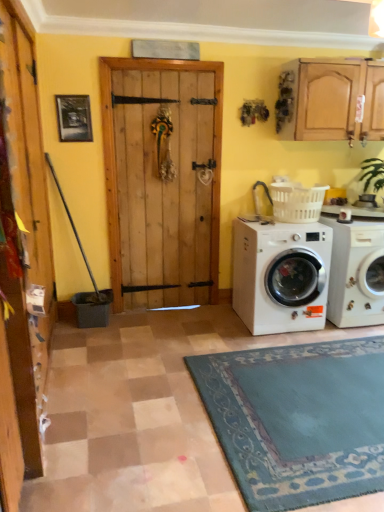
What is the approximate width of wooden door at left?

3.96 inches.

Where is `white plastic laundry basket at right`? The height and width of the screenshot is (512, 384). white plastic laundry basket at right is located at coordinates (296, 202).

Image resolution: width=384 pixels, height=512 pixels. What are the coordinates of `wooden door at left` in the screenshot? It's located at (25, 227).

Looking at their sizes, would you say wooden door at left is wider or thinner than white glossy washing machine at lower right, which is the 1th washing machine in right-to-left order?

Considering their sizes, wooden door at left looks slimmer than white glossy washing machine at lower right, which is the 1th washing machine in right-to-left order.

Does wooden door at left have a larger size compared to white glossy washing machine at lower right, the second washing machine when ordered from left to right?

Actually, wooden door at left might be smaller than white glossy washing machine at lower right, the second washing machine when ordered from left to right.

Between point (37, 308) and point (369, 293), which one is positioned in front?

The point (37, 308) is closer to the camera.

From the image's perspective, is wooden door at left above or below white glossy washing machine at lower right, the second washing machine when ordered from left to right?

From the image's perspective, wooden door at left appears above white glossy washing machine at lower right, the second washing machine when ordered from left to right.

Are white glossy washing machine at lower right, which is the 1th washing machine in right-to-left order, and white matte washing machine at lower right, marked as the 1th washing machine in a left-to-right arrangement, beside each other?

No, white glossy washing machine at lower right, which is the 1th washing machine in right-to-left order, is not next to white matte washing machine at lower right, marked as the 1th washing machine in a left-to-right arrangement.

Looking at this image, which is correct: white glossy washing machine at lower right, the second washing machine when ordered from left to right, is inside white matte washing machine at lower right, marked as the 1th washing machine in a left-to-right arrangement, or outside of it?

white glossy washing machine at lower right, the second washing machine when ordered from left to right, is outside white matte washing machine at lower right, marked as the 1th washing machine in a left-to-right arrangement.

Does white glossy washing machine at lower right, which is the 1th washing machine in right-to-left order, have a greater height compared to white matte washing machine at lower right, which is the second washing machine in right-to-left order?

Correct, white glossy washing machine at lower right, which is the 1th washing machine in right-to-left order, is much taller as white matte washing machine at lower right, which is the second washing machine in right-to-left order.

From the image's perspective, is white glossy washing machine at lower right, the second washing machine when ordered from left to right, located above or below white matte washing machine at lower right, which is the second washing machine in right-to-left order?

white glossy washing machine at lower right, the second washing machine when ordered from left to right, is situated higher than white matte washing machine at lower right, which is the second washing machine in right-to-left order, in the image.

From a real-world perspective, which is physically above, white plastic laundry basket at right or white glossy washing machine at lower right, which is the 1th washing machine in right-to-left order?

In real-world perspective, white plastic laundry basket at right is above.

Which object is thinner, white plastic laundry basket at right or white glossy washing machine at lower right, which is the 1th washing machine in right-to-left order?

With smaller width is white plastic laundry basket at right.

Between white plastic laundry basket at right and white glossy washing machine at lower right, the second washing machine when ordered from left to right, which one has more height?

white glossy washing machine at lower right, the second washing machine when ordered from left to right.

Can you confirm if white plastic laundry basket at right is bigger than white glossy washing machine at lower right, the second washing machine when ordered from left to right?

Actually, white plastic laundry basket at right might be smaller than white glossy washing machine at lower right, the second washing machine when ordered from left to right.

Does white glossy washing machine at lower right, which is the 1th washing machine in right-to-left order, turn towards white plastic laundry basket at right?

No, white glossy washing machine at lower right, which is the 1th washing machine in right-to-left order, does not turn towards white plastic laundry basket at right.

Are white glossy washing machine at lower right, the second washing machine when ordered from left to right, and white plastic laundry basket at right making contact?

They are not placed beside each other.

From the image's perspective, is white glossy washing machine at lower right, the second washing machine when ordered from left to right, on white plastic laundry basket at right?

No.

Which of these two, white matte washing machine at lower right, marked as the 1th washing machine in a left-to-right arrangement, or white glossy washing machine at lower right, which is the 1th washing machine in right-to-left order, stands taller?

white glossy washing machine at lower right, which is the 1th washing machine in right-to-left order, is taller.

Is white matte washing machine at lower right, marked as the 1th washing machine in a left-to-right arrangement, far away from white glossy washing machine at lower right, the second washing machine when ordered from left to right?

No, there isn't a large distance between white matte washing machine at lower right, marked as the 1th washing machine in a left-to-right arrangement, and white glossy washing machine at lower right, the second washing machine when ordered from left to right.

The image size is (384, 512). Identify the location of washing machine that appears behind the white matte washing machine at lower right, which is the second washing machine in right-to-left order. (356, 273).

Does point (327, 286) come farther from viewer compared to point (330, 309)?

No, it is in front of (330, 309).

Is the depth of wooden door at left greater than that of white plastic laundry basket at right?

No, wooden door at left is closer to the viewer.

Based on their sizes in the image, would you say wooden door at left is bigger or smaller than white plastic laundry basket at right?

Considering their sizes, wooden door at left takes up less space than white plastic laundry basket at right.

Identify the location of barn door above the white glossy washing machine at lower right, which is the 1th washing machine in right-to-left order (from a real-world perspective). The image size is (384, 512). (25, 227).

From the picture: Is white glossy washing machine at lower right, which is the 1th washing machine in right-to-left order, behind wooden door at left?

Yes, white glossy washing machine at lower right, which is the 1th washing machine in right-to-left order, is further from the camera.

Consider the image. Is white glossy washing machine at lower right, the second washing machine when ordered from left to right, at the right side of wooden door at left?

Yes.

Is wooden door at left located within white glossy washing machine at lower right, the second washing machine when ordered from left to right?

No, wooden door at left is located outside of white glossy washing machine at lower right, the second washing machine when ordered from left to right.

Find the location of `barn door located on the left of white glossy washing machine at lower right, which is the 1th washing machine in right-to-left order`. barn door located on the left of white glossy washing machine at lower right, which is the 1th washing machine in right-to-left order is located at coordinates (25, 227).

Locate an element on the screen. This screenshot has width=384, height=512. washing machine that is above the white glossy washing machine at lower right, the second washing machine when ordered from left to right (from a real-world perspective) is located at coordinates (281, 276).

From the image, which object appears to be nearer to white plastic laundry basket at right, white glossy washing machine at lower right, which is the 1th washing machine in right-to-left order, or wooden door at left?

The object closer to white plastic laundry basket at right is white glossy washing machine at lower right, which is the 1th washing machine in right-to-left order.

When comparing their distances from white plastic laundry basket at right, does white matte washing machine at lower right, marked as the 1th washing machine in a left-to-right arrangement, or white glossy washing machine at lower right, the second washing machine when ordered from left to right, seem further?

Among the two, white glossy washing machine at lower right, the second washing machine when ordered from left to right, is located further to white plastic laundry basket at right.

Considering their positions, is white plastic laundry basket at right positioned closer to white matte washing machine at lower right, which is the second washing machine in right-to-left order, than wooden door at left?

white plastic laundry basket at right is closer to white matte washing machine at lower right, which is the second washing machine in right-to-left order.

From the picture: When comparing their distances from white glossy washing machine at lower right, the second washing machine when ordered from left to right, does white matte washing machine at lower right, which is the second washing machine in right-to-left order, or wooden door at left seem closer?

white matte washing machine at lower right, which is the second washing machine in right-to-left order, lies closer to white glossy washing machine at lower right, the second washing machine when ordered from left to right, than the other object.

In the scene shown: Based on their spatial positions, is white glossy washing machine at lower right, the second washing machine when ordered from left to right, or white matte washing machine at lower right, which is the second washing machine in right-to-left order, further from wooden door at left?

white glossy washing machine at lower right, the second washing machine when ordered from left to right, lies further to wooden door at left than the other object.

From the image, which object appears to be farther from white glossy washing machine at lower right, which is the 1th washing machine in right-to-left order, wooden door at left or white plastic laundry basket at right?

wooden door at left is positioned further to the anchor white glossy washing machine at lower right, which is the 1th washing machine in right-to-left order.

Looking at the image, which one is located closer to white matte washing machine at lower right, which is the second washing machine in right-to-left order, wooden door at left or white glossy washing machine at lower right, the second washing machine when ordered from left to right?

The object closer to white matte washing machine at lower right, which is the second washing machine in right-to-left order, is white glossy washing machine at lower right, the second washing machine when ordered from left to right.

Which object lies nearer to the anchor point wooden door at left, white glossy washing machine at lower right, the second washing machine when ordered from left to right, or white plastic laundry basket at right?

white plastic laundry basket at right.

Image resolution: width=384 pixels, height=512 pixels. Find the location of `laundry basket between white matte washing machine at lower right, which is the second washing machine in right-to-left order, and white glossy washing machine at lower right, the second washing machine when ordered from left to right`. laundry basket between white matte washing machine at lower right, which is the second washing machine in right-to-left order, and white glossy washing machine at lower right, the second washing machine when ordered from left to right is located at coordinates (296, 202).

Where is `washing machine between wooden door at left and white glossy washing machine at lower right, the second washing machine when ordered from left to right, from left to right`? This screenshot has width=384, height=512. washing machine between wooden door at left and white glossy washing machine at lower right, the second washing machine when ordered from left to right, from left to right is located at coordinates (281, 276).